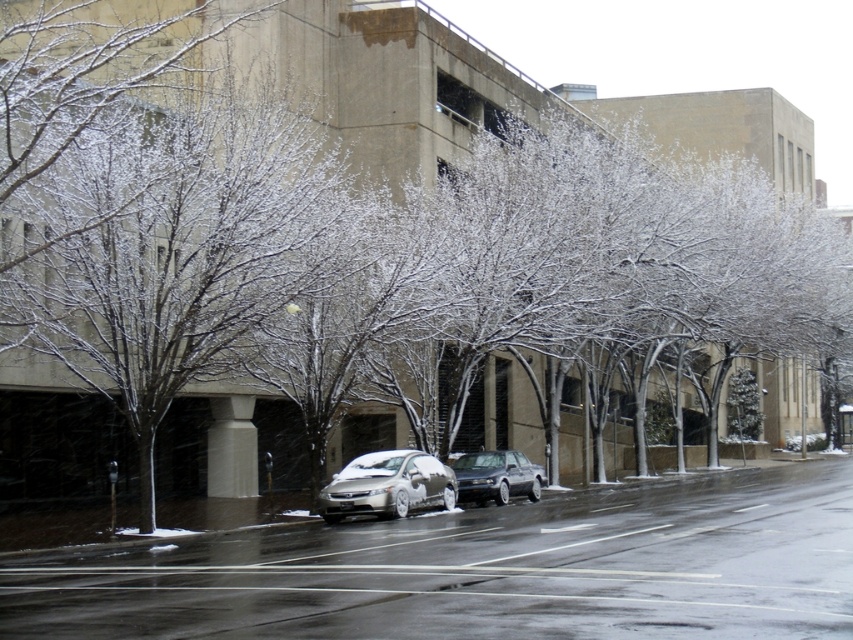
Question: Which point appears farthest from the camera in this image?

Choices:
 (A) click(x=198, y=124)
 (B) click(x=338, y=504)
 (C) click(x=552, y=563)

Answer: (A)

Question: From the image, what is the correct spatial relationship of satin gold sedan at center in relation to shiny silver sedan at center?

Choices:
 (A) right
 (B) left

Answer: (B)

Question: Which point is farther to the camera?

Choices:
 (A) (194, 600)
 (B) (509, 481)
 (C) (404, 496)

Answer: (B)

Question: Can you confirm if snow-covered branches at left is wider than satin gold sedan at center?

Choices:
 (A) yes
 (B) no

Answer: (A)

Question: Is snow-covered branches at left positioned before satin gold sedan at center?

Choices:
 (A) yes
 (B) no

Answer: (A)

Question: Which of the following is the closest to the observer?

Choices:
 (A) (103, 291)
 (B) (460, 499)

Answer: (A)